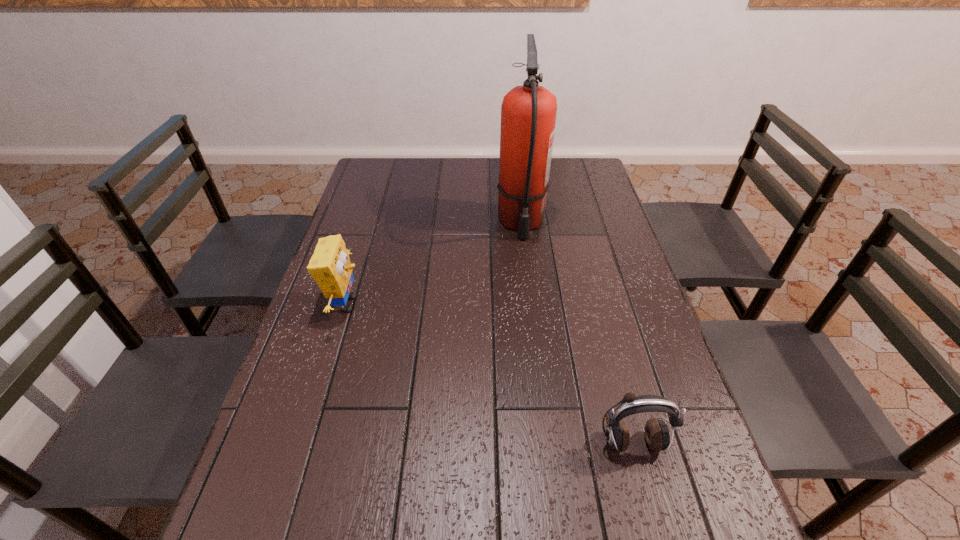
Image resolution: width=960 pixels, height=540 pixels. I want to click on vacant space that's between the rightmost object and the second farthest object, so click(x=490, y=374).

The height and width of the screenshot is (540, 960). What are the coordinates of `vacant area that lies between the nearest object and the second nearest object` in the screenshot? It's located at (490, 374).

The image size is (960, 540). I want to click on vacant space that's between the farthest object and the earphone, so click(x=576, y=333).

Locate an element on the screen. The width and height of the screenshot is (960, 540). empty space between the second farthest object and the farthest object is located at coordinates (434, 264).

Where is `vacant space that is in between the earphone and the second nearest object`? vacant space that is in between the earphone and the second nearest object is located at coordinates (490, 374).

Identify the location of object that ranks as the second closest to the leftmost object. This screenshot has height=540, width=960. (657, 435).

Select which object appears as the second closest to the earphone. Please provide its 2D coordinates. Your answer should be formatted as a tuple, i.e. [(x, y)], where the tuple contains the x and y coordinates of a point satisfying the conditions above.

[(528, 113)]

Identify the location of vacant area in the image that satisfies the following two spatial constraints: 1. on the nozzle of the tallest object; 2. on the face of the sponge. The height and width of the screenshot is (540, 960). (530, 305).

Find the location of a particular element. The image size is (960, 540). vacant space that satisfies the following two spatial constraints: 1. on the nozzle of the tallest object; 2. on the face of the leftmost object is located at coordinates (530, 305).

This screenshot has width=960, height=540. I want to click on free spot that satisfies the following two spatial constraints: 1. on the nozzle of the tallest object; 2. on the face of the second farthest object, so click(530, 305).